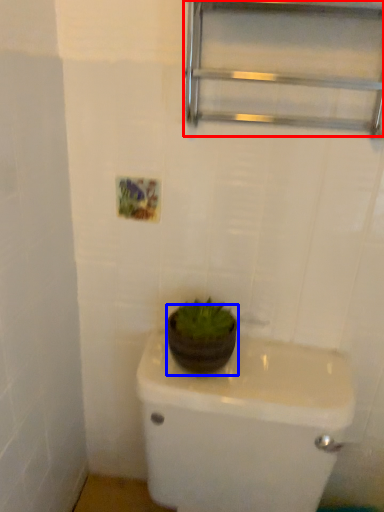
Question: Which point is further to the camera, shelf (highlighted by a red box) or flowerpot (highlighted by a blue box)?

Choices:
 (A) shelf
 (B) flowerpot

Answer: (B)